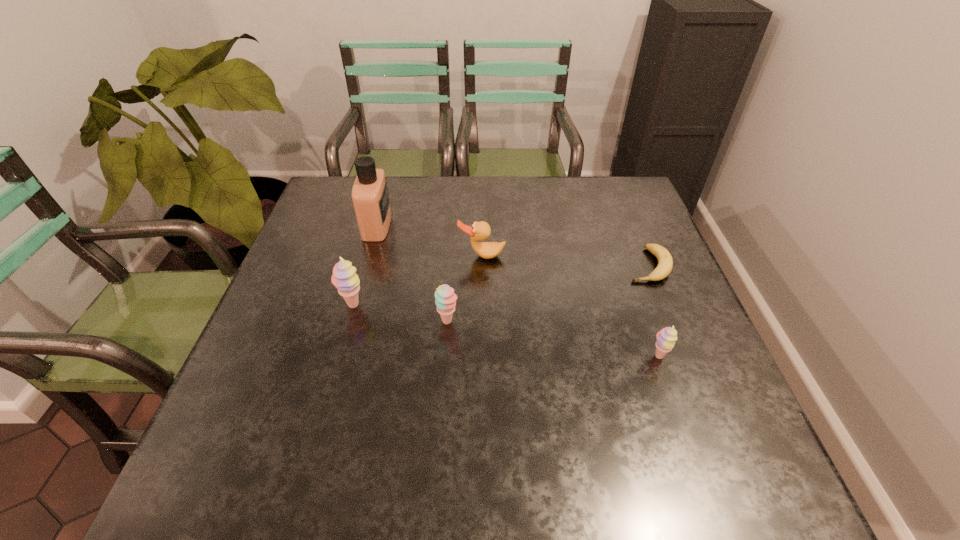
I want to click on the leftmost sherbert, so click(344, 278).

Locate an element on the screen. This screenshot has width=960, height=540. the tallest sherbert is located at coordinates (344, 278).

Where is `the second tallest sherbert`? Image resolution: width=960 pixels, height=540 pixels. the second tallest sherbert is located at coordinates (445, 298).

Identify the location of the nearest sherbert. (666, 338).

Identify the location of the shortest sherbert. (666, 338).

In order to click on the shortest object in this screenshot , I will do `click(665, 263)`.

Find the location of a particular element. The width and height of the screenshot is (960, 540). perfume is located at coordinates (370, 197).

Locate an element on the screen. The image size is (960, 540). the tallest object is located at coordinates (370, 197).

Locate an element on the screen. Image resolution: width=960 pixels, height=540 pixels. duck is located at coordinates (479, 231).

At what (x,y) coordinates should I click in order to perform the action: click on vacant space situated on the right of the tallest sherbert. Please return your answer as a coordinate pair (x, y). Looking at the image, I should click on (533, 306).